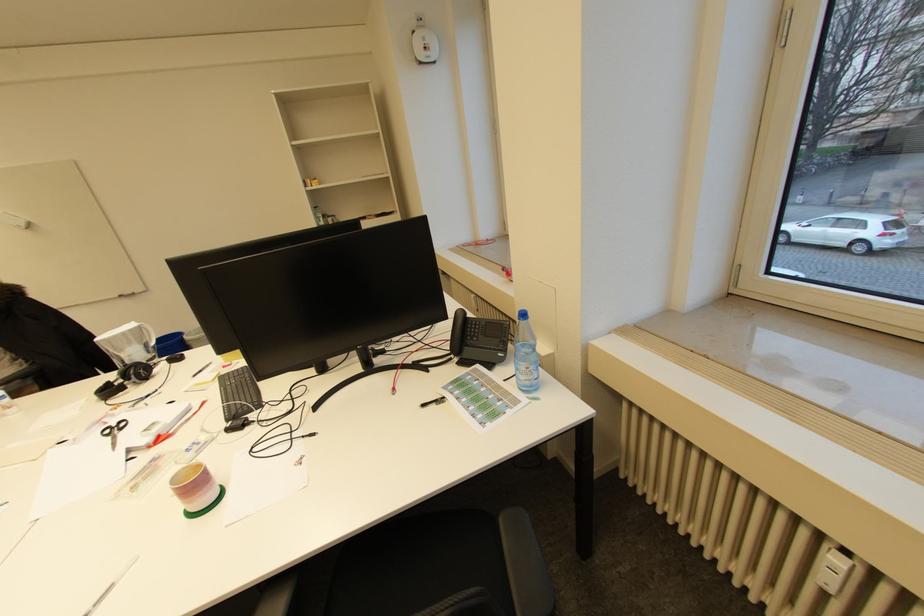
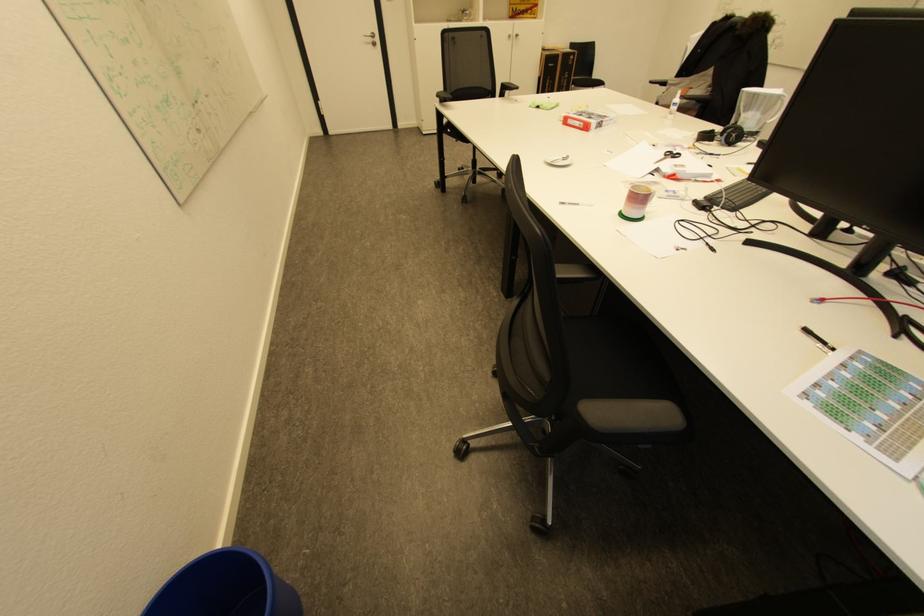
Looking at this image, based on the continuous images, in which direction is the camera rotating?

The rotation direction of the camera is left-down.